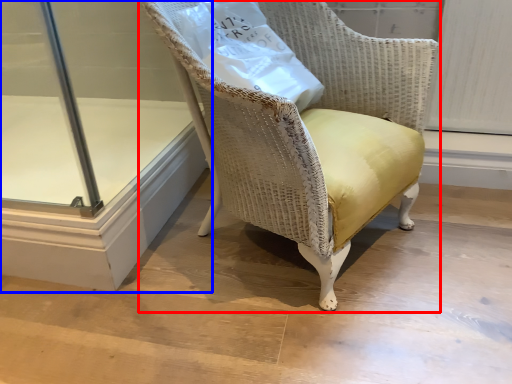
Question: Which object appears closest to the camera in this image, chair (highlighted by a red box) or glass door (highlighted by a blue box)?

Choices:
 (A) chair
 (B) glass door

Answer: (A)